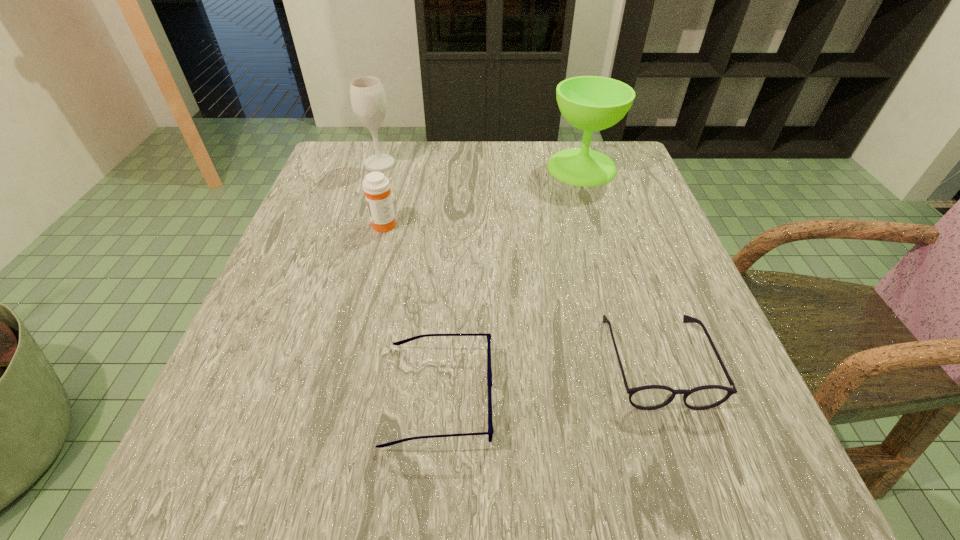
This screenshot has width=960, height=540. I want to click on the left wineglass, so click(367, 95).

Where is `the right wineglass`? the right wineglass is located at coordinates (591, 103).

The height and width of the screenshot is (540, 960). Identify the location of the third farthest object. (376, 186).

Where is `medicine`? This screenshot has height=540, width=960. medicine is located at coordinates (376, 186).

You are a GUI agent. You are given a task and a screenshot of the screen. Output one action in this format:
    pyautogui.click(x=<x>, y=<y>)
    Task: Click on the right spectacles
    This screenshot has height=540, width=960.
    Given the screenshot: What is the action you would take?
    pyautogui.click(x=649, y=397)

Find the location of `the third object from left to right`. the third object from left to right is located at coordinates (x=490, y=432).

Identify the location of vacant position located on the front of the left wineglass. The width and height of the screenshot is (960, 540). (372, 190).

Where is `free point located 0.070m on the front of the right wineglass`? free point located 0.070m on the front of the right wineglass is located at coordinates (593, 205).

Identify the location of free location located on the left of the third tallest object. (319, 224).

This screenshot has width=960, height=540. What are the coordinates of `free region located on the front-facing side of the left spectacles` in the screenshot? It's located at (589, 395).